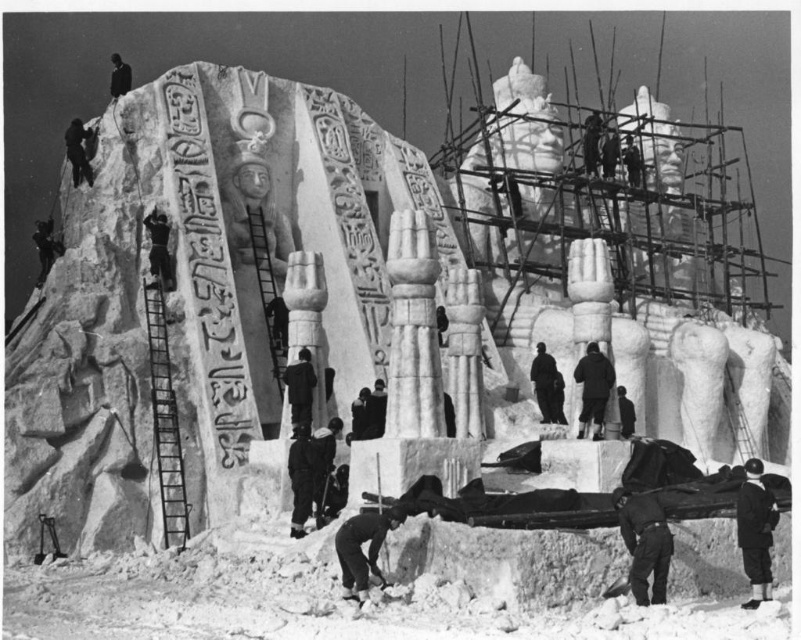
You are an art conservator assessing the sculpture project. You notice the black fabric at lower right and the dark gray stone figure at center. Which object has a greater height?

The black fabric at lower right is taller than the dark gray stone figure at center according to the description provided.

You are an art conservator standing at the base of the sculpture. You need to reach the dark wool coat at center located at point 0.608, 0.742. What direction should you move to reach it?

The dark wool coat at center is located at coordinates [594,388]. Since the conservator is at the base, moving towards the center of the sculpture would lead them to the coat.

In the scene shown: You are an artist working on the sculpture project and need to choose between the dark gray uniform at lower right and the dark wool coat at center for your outfit. Which garment would allow you to move more freely while working in the confined spaces around the scaffolding?

The dark gray uniform at lower right has a smaller width than the dark wool coat at center, so it would allow for more freedom of movement in confined spaces.